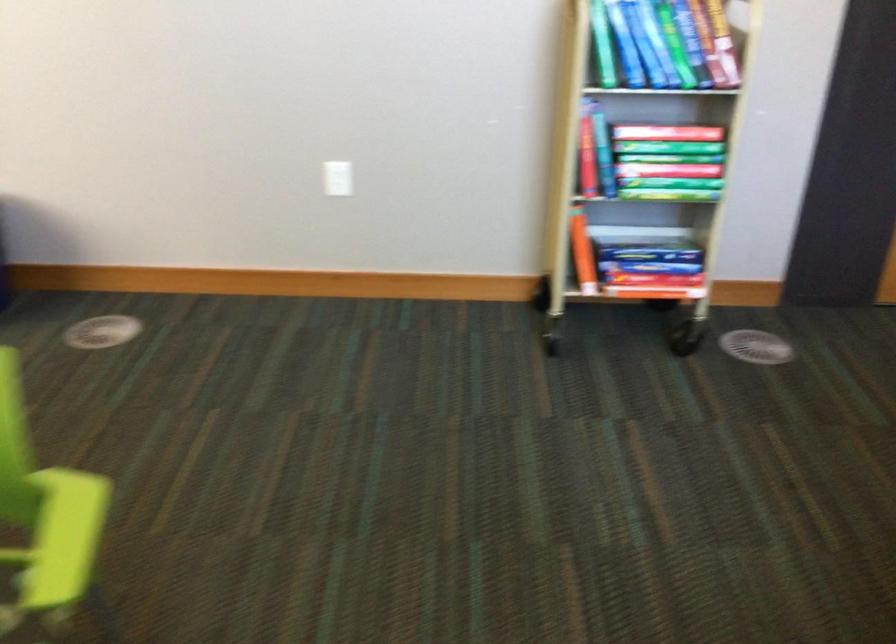
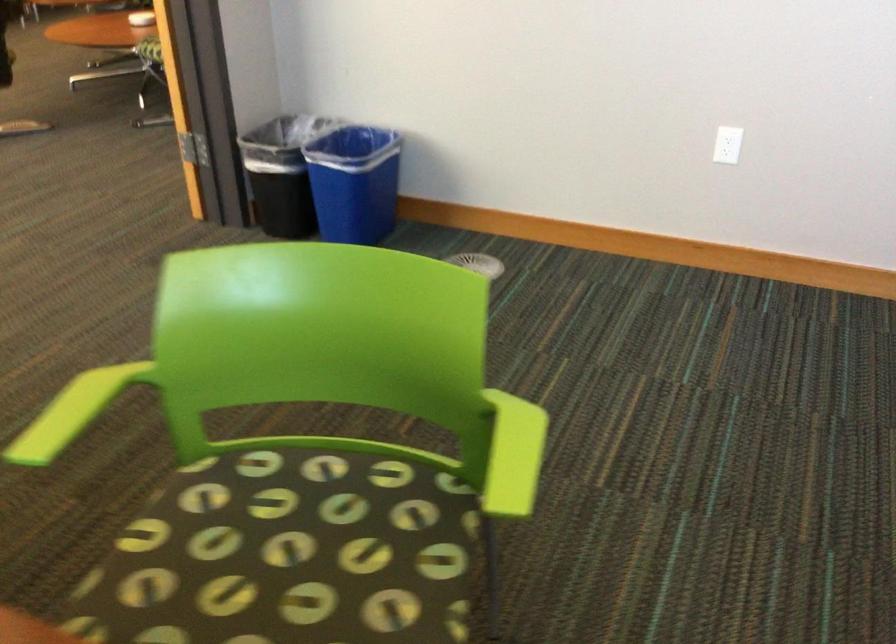
Question: I am providing you with two images of the same scene from different viewpoints. Please identify which objects are invisible in image2.

Choices:
 (A) black trash can
 (B) green chair armrest
 (C) white wall outlet
 (D) none of these

Answer: (D)